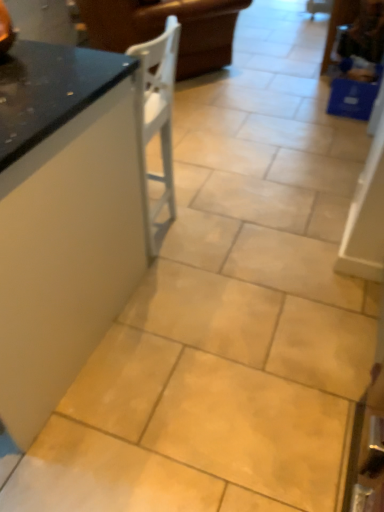
Question: Is black glossy countertop at left looking in the opposite direction of white wood chair at upper left?

Choices:
 (A) yes
 (B) no

Answer: (B)

Question: Is black glossy countertop at left outside of white wood chair at upper left?

Choices:
 (A) no
 (B) yes

Answer: (B)

Question: Does black glossy countertop at left have a smaller size compared to white wood chair at upper left?

Choices:
 (A) yes
 (B) no

Answer: (A)

Question: Can you see black glossy countertop at left touching white wood chair at upper left?

Choices:
 (A) no
 (B) yes

Answer: (A)

Question: Can you confirm if black glossy countertop at left is taller than white wood chair at upper left?

Choices:
 (A) yes
 (B) no

Answer: (A)

Question: From a real-world perspective, is black glossy countertop at left under white wood chair at upper left?

Choices:
 (A) yes
 (B) no

Answer: (B)

Question: From the image's perspective, would you say white wood chair at upper left is positioned over black glossy countertop at left?

Choices:
 (A) no
 (B) yes

Answer: (B)

Question: Does white wood chair at upper left turn towards black glossy countertop at left?

Choices:
 (A) no
 (B) yes

Answer: (A)

Question: Is white wood chair at upper left not inside black glossy countertop at left?

Choices:
 (A) no
 (B) yes

Answer: (B)

Question: Does white wood chair at upper left have a lesser height compared to black glossy countertop at left?

Choices:
 (A) yes
 (B) no

Answer: (A)

Question: Is black glossy countertop at left inside white wood chair at upper left?

Choices:
 (A) yes
 (B) no

Answer: (B)

Question: Does white wood chair at upper left have a smaller size compared to black glossy countertop at left?

Choices:
 (A) no
 (B) yes

Answer: (A)

Question: Looking at the image, does white wood chair at upper left seem bigger or smaller compared to black glossy countertop at left?

Choices:
 (A) big
 (B) small

Answer: (A)